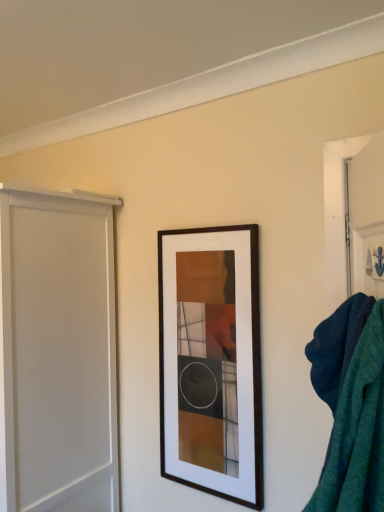
Question: Considering the relative sizes of white matte screen door at left and wooden picture frame at center in the image provided, is white matte screen door at left bigger than wooden picture frame at center?

Choices:
 (A) yes
 (B) no

Answer: (A)

Question: Is white matte screen door at left thinner than wooden picture frame at center?

Choices:
 (A) no
 (B) yes

Answer: (A)

Question: Considering the relative sizes of white matte screen door at left and wooden picture frame at center in the image provided, is white matte screen door at left taller than wooden picture frame at center?

Choices:
 (A) no
 (B) yes

Answer: (B)

Question: Is white matte screen door at left beside wooden picture frame at center?

Choices:
 (A) yes
 (B) no

Answer: (B)

Question: Does white matte screen door at left appear on the left side of wooden picture frame at center?

Choices:
 (A) yes
 (B) no

Answer: (A)

Question: Does white matte screen door at left turn towards wooden picture frame at center?

Choices:
 (A) no
 (B) yes

Answer: (A)

Question: Is teal fabric bath towel at right looking in the opposite direction of wooden picture frame at center?

Choices:
 (A) yes
 (B) no

Answer: (B)

Question: Is wooden picture frame at center surrounded by teal fabric bath towel at right?

Choices:
 (A) yes
 (B) no

Answer: (B)

Question: From the image's perspective, is teal fabric bath towel at right beneath wooden picture frame at center?

Choices:
 (A) no
 (B) yes

Answer: (A)

Question: Is teal fabric bath towel at right at the left side of wooden picture frame at center?

Choices:
 (A) yes
 (B) no

Answer: (B)

Question: Considering the relative positions of teal fabric bath towel at right and wooden picture frame at center in the image provided, is teal fabric bath towel at right behind wooden picture frame at center?

Choices:
 (A) yes
 (B) no

Answer: (B)

Question: Considering the relative sizes of teal fabric bath towel at right and wooden picture frame at center in the image provided, is teal fabric bath towel at right thinner than wooden picture frame at center?

Choices:
 (A) no
 (B) yes

Answer: (A)

Question: From the image's perspective, is white matte screen door at left located above teal fabric bath towel at right?

Choices:
 (A) yes
 (B) no

Answer: (B)